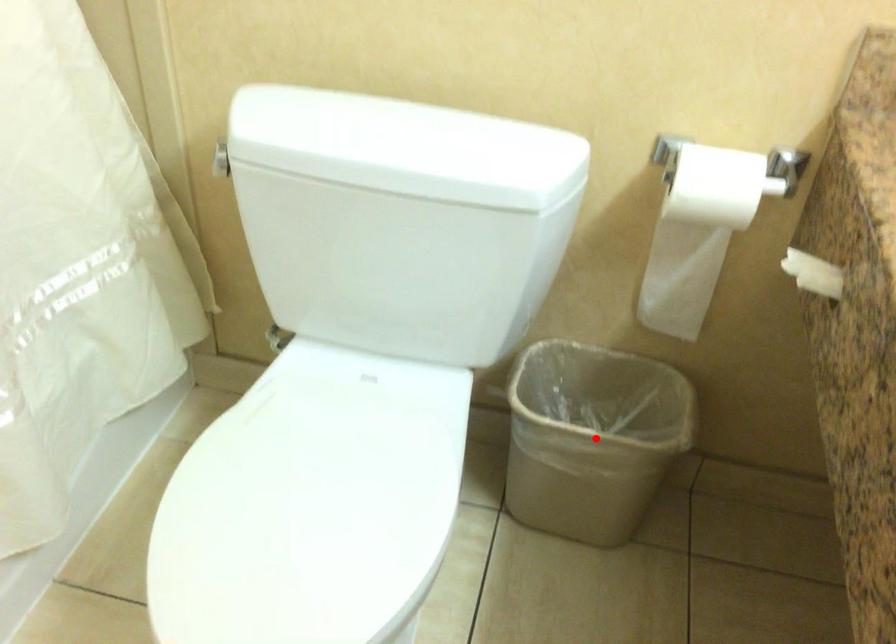
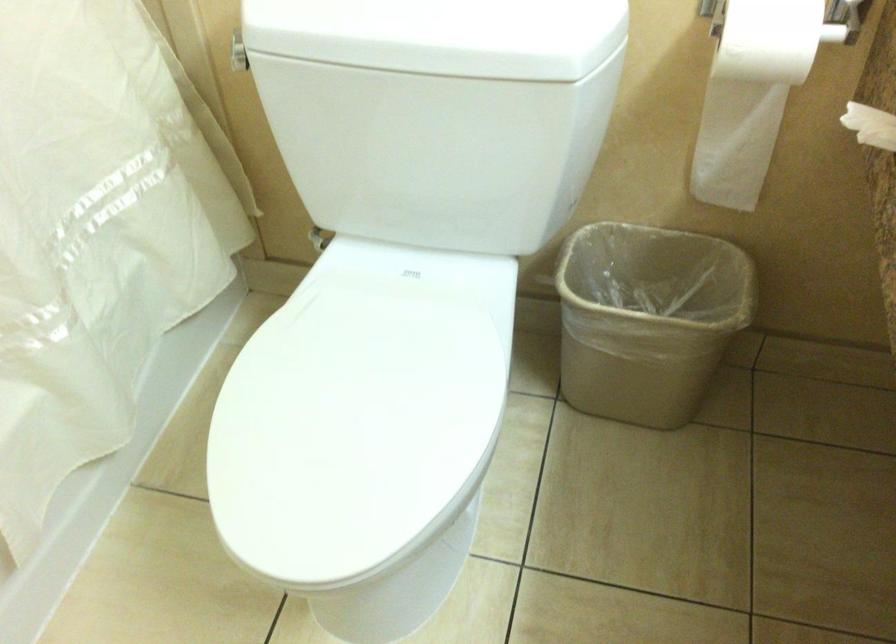
Question: I am providing you with two images of the same scene from different viewpoints. A red point is marked on the first image. At the location where the point appears in image 1, is it still visible in image 2?

Choices:
 (A) Yes
 (B) No

Answer: (A)